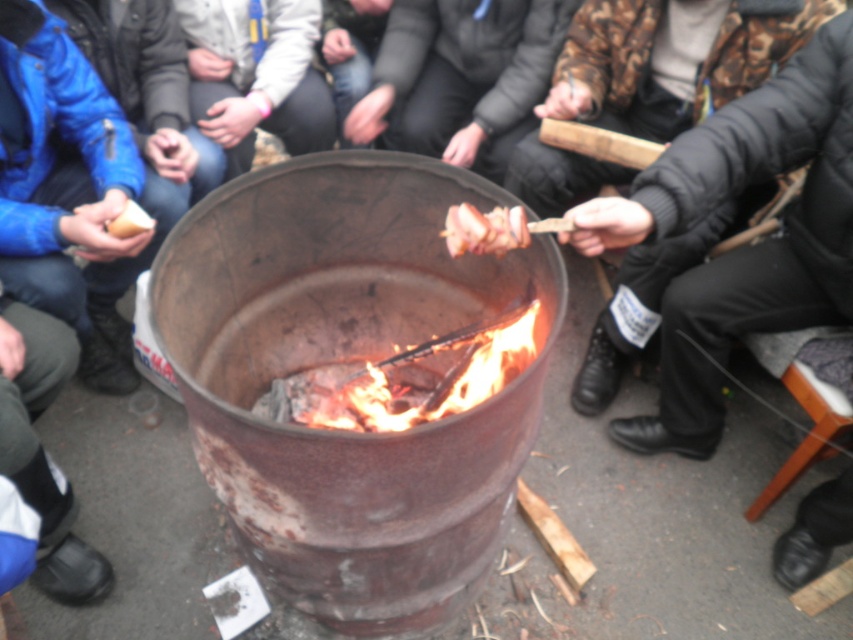
Based on the scene, which object is positioned higher relative to the other? The black puffy jacket at upper right or the brown wooden skewer at center?

The brown wooden skewer at center is higher than the black puffy jacket at upper right because the black puffy jacket at upper right is below the brown wooden skewer at center.

You are standing at the origin point in the image and want to hand a hot beverage to the person wearing the black puffy jacket at upper right. Which direction should you move to reach their location?

The black puffy jacket at upper right is located at point (x=741, y=248), so you should move towards the upper right direction to reach their location.

You are planning to cook a marshmallow over the fire. The charcoal wood at center is where the flames are strongest. Since the matte brown bread at left is on the opposite side, will the bread be closer to the heat source?

The charcoal wood at center is to the right of matte brown bread at left, so the bread is positioned away from the strongest flames. Therefore, the bread will not be as close to the heat source as the charcoal wood at center.